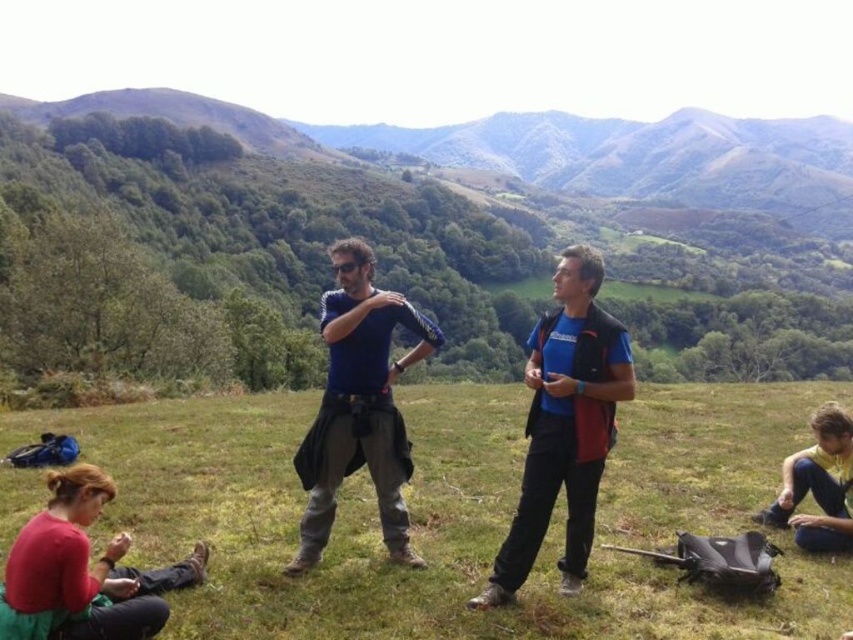
From the picture: Can you confirm if blue matte shirt at center is wider than yellow fabric shirt at lower right?

Yes.

The height and width of the screenshot is (640, 853). What are the coordinates of `blue matte shirt at center` in the screenshot? It's located at (358, 404).

Find the location of a particular element. blue matte shirt at center is located at coordinates (358, 404).

Is green grassy field at center wider than blue fabric shirt at center?

Correct, the width of green grassy field at center exceeds that of blue fabric shirt at center.

Is green grassy field at center smaller than blue fabric shirt at center?

No.

Measure the distance between green grassy field at center and camera.

green grassy field at center is 17.50 feet from camera.

At what (x,y) coordinates should I click in order to perform the action: click on green grassy field at center. Please return your answer as a coordinate pair (x, y). The height and width of the screenshot is (640, 853). Looking at the image, I should click on pos(456,515).

Does blue fabric shirt at center have a greater width compared to yellow fabric shirt at lower right?

Yes.

Is blue fabric shirt at center bigger than yellow fabric shirt at lower right?

Correct, blue fabric shirt at center is larger in size than yellow fabric shirt at lower right.

Which is in front, point (547, 456) or point (848, 547)?

Point (547, 456) is more forward.

Where is `blue fabric shirt at center`? This screenshot has height=640, width=853. blue fabric shirt at center is located at coordinates (564, 424).